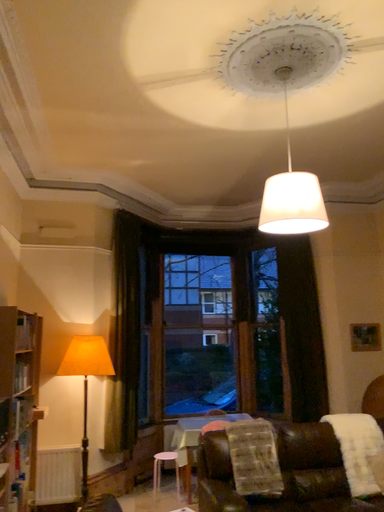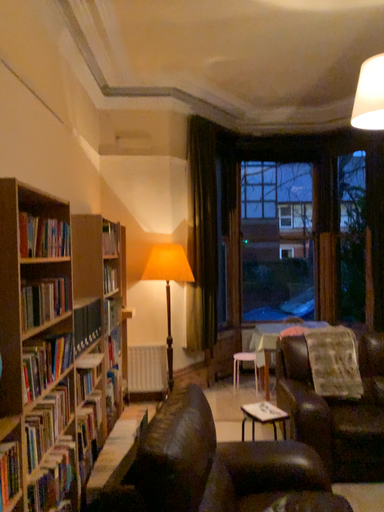
Question: How did the camera likely rotate when shooting the video?

Choices:
 (A) rotated downward
 (B) rotated upward

Answer: (A)